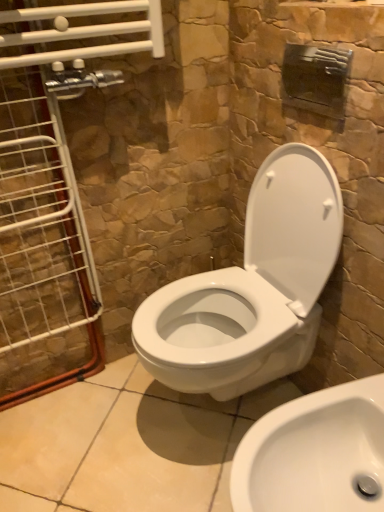
Question: Considering the positions of clear glass door at left and white glossy sink at lower right in the image, is clear glass door at left taller or shorter than white glossy sink at lower right?

Choices:
 (A) short
 (B) tall

Answer: (B)

Question: Considering their positions, is clear glass door at left located in front of or behind white glossy sink at lower right?

Choices:
 (A) front
 (B) behind

Answer: (B)

Question: Which object is positioned farthest from the white glossy sink at lower right?

Choices:
 (A) white glossy toilet at center
 (B) clear glass door at left

Answer: (B)

Question: Which object is the farthest from the white glossy toilet at center?

Choices:
 (A) white glossy sink at lower right
 (B) clear glass door at left

Answer: (B)